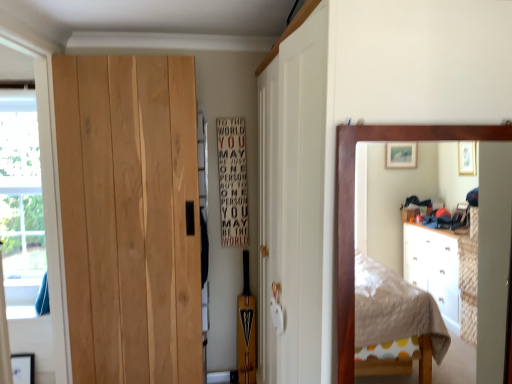
Question: Is transparent plastic window screen at left to the right of natural wood door at left from the viewer's perspective?

Choices:
 (A) yes
 (B) no

Answer: (B)

Question: From a real-world perspective, is transparent plastic window screen at left under natural wood door at left?

Choices:
 (A) no
 (B) yes

Answer: (A)

Question: Can you confirm if transparent plastic window screen at left is taller than natural wood door at left?

Choices:
 (A) yes
 (B) no

Answer: (B)

Question: Is transparent plastic window screen at left to the left of natural wood door at left from the viewer's perspective?

Choices:
 (A) yes
 (B) no

Answer: (A)

Question: Is transparent plastic window screen at left further to camera compared to natural wood door at left?

Choices:
 (A) yes
 (B) no

Answer: (A)

Question: In the image, is natural wood door at left on the left side or the right side of white wood sign at center?

Choices:
 (A) right
 (B) left

Answer: (B)

Question: From their relative heights in the image, would you say natural wood door at left is taller or shorter than white wood sign at center?

Choices:
 (A) short
 (B) tall

Answer: (B)

Question: Is natural wood door at left in front of or behind white wood sign at center in the image?

Choices:
 (A) front
 (B) behind

Answer: (A)

Question: Based on their sizes in the image, would you say natural wood door at left is bigger or smaller than white wood sign at center?

Choices:
 (A) small
 (B) big

Answer: (B)

Question: Is point (x=10, y=135) positioned closer to the camera than point (x=186, y=364)?

Choices:
 (A) farther
 (B) closer

Answer: (B)

Question: Considering the positions of transparent plastic window screen at left and natural wood door at left in the image, is transparent plastic window screen at left taller or shorter than natural wood door at left?

Choices:
 (A) short
 (B) tall

Answer: (A)

Question: Is transparent plastic window screen at left wider or thinner than natural wood door at left?

Choices:
 (A) thin
 (B) wide

Answer: (B)

Question: Is transparent plastic window screen at left bigger or smaller than natural wood door at left?

Choices:
 (A) big
 (B) small

Answer: (B)

Question: From the image's perspective, relative to transparent plastic window screen at left, is natural wood door at left above or below?

Choices:
 (A) below
 (B) above

Answer: (A)

Question: Considering the positions of point (143, 129) and point (23, 152), is point (143, 129) closer or farther from the camera than point (23, 152)?

Choices:
 (A) closer
 (B) farther

Answer: (A)